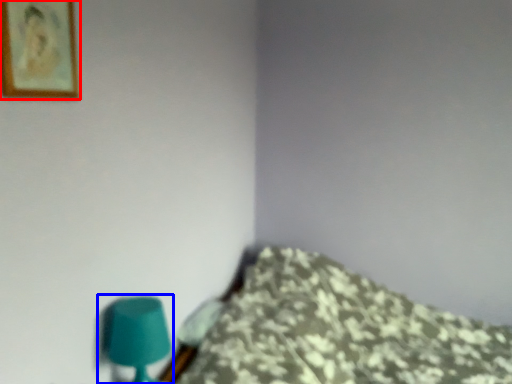
Question: Which object appears closest to the camera in this image, picture frame (highlighted by a red box) or table lamp (highlighted by a blue box)?

Choices:
 (A) picture frame
 (B) table lamp

Answer: (A)